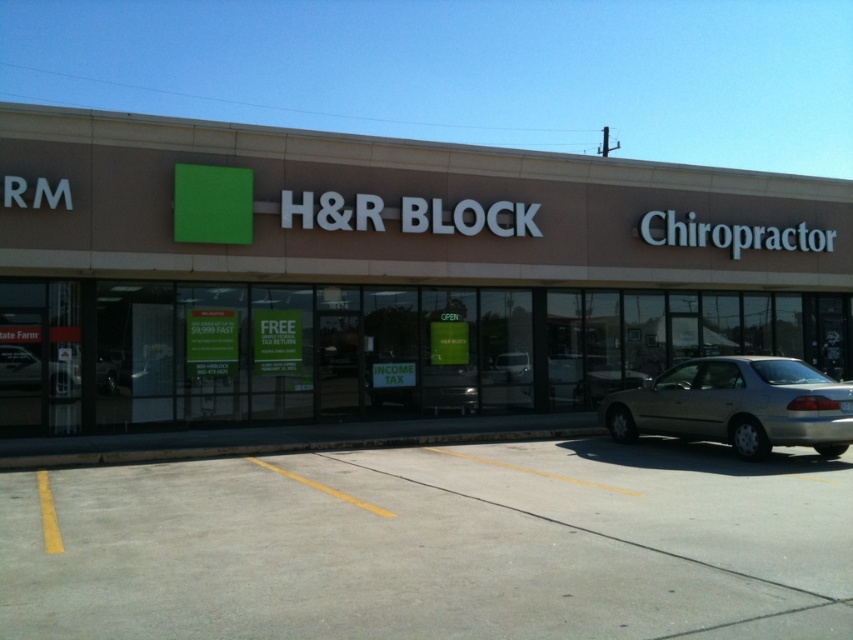
Based on the photo, you are driving a gold metallic sedan at lower right and want to park it in front of the brown matte building at center. Is there enough space between them for you to open the car door without hitting the building?

The brown matte building at center is positioned over gold metallic sedan at lower right, meaning there is no space between them. Therefore, you cannot open the car door without hitting the building.

In the scene shown: You are a delivery person trying to park your gold metallic sedan at lower right near the brown matte building at center. Based on their sizes, will the sedan fit in the parking space next to the building?

The brown matte building at center is larger than the gold metallic sedan at lower right, so the sedan should fit in the parking space next to the building since it is smaller in size.

You are planning to park your car in the gray concrete parking lot at lower center near the brown matte building at center. Considering the size of the parking lot, will you have enough space to park comfortably?

The brown matte building at center is wider than the gray concrete parking lot at lower center, so the parking lot may be narrower than the building. This could mean limited space for parking comfortably.